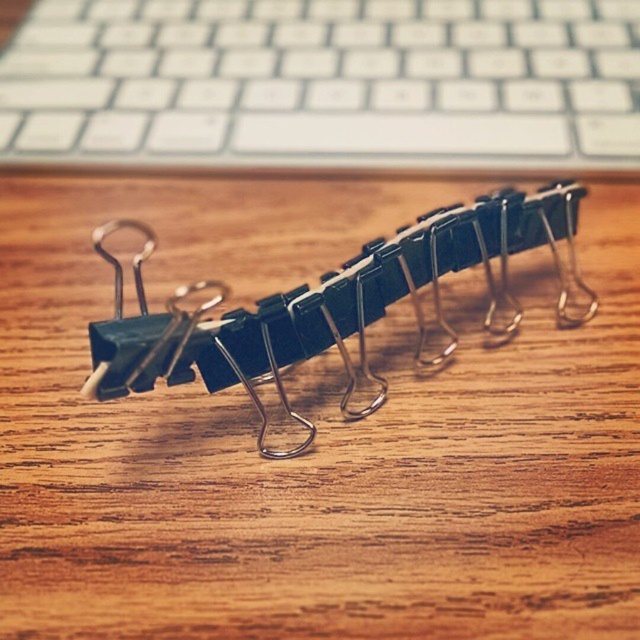
Does white plastic keyboard at upper center have a greater height compared to metallic silver binder clip at center?

No.

Between white plastic keyboard at upper center and metallic silver binder clip at center, which one is positioned lower?

metallic silver binder clip at center

The image size is (640, 640). In order to click on white plastic keyboard at upper center in this screenshot , I will do `click(324, 83)`.